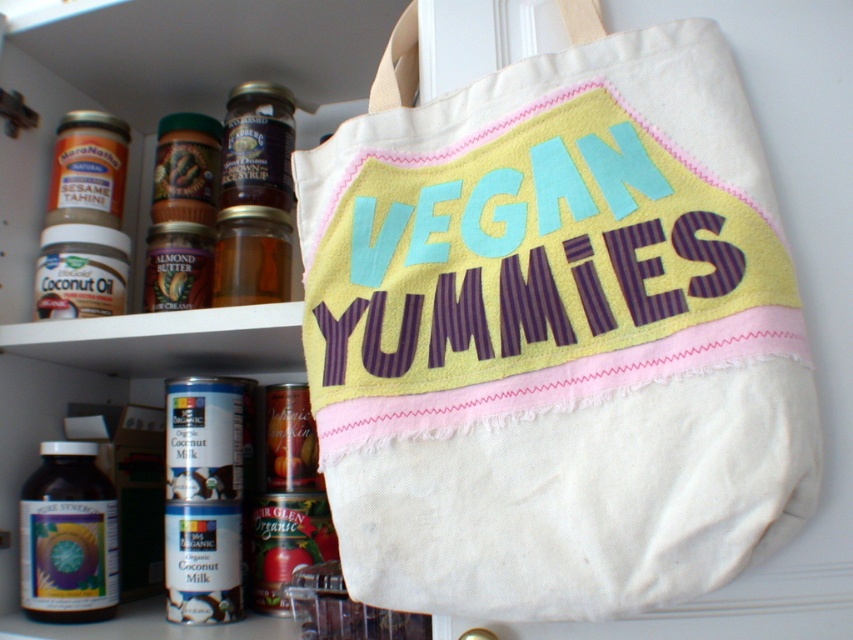
You are organizing a picnic and have both the white canvas tote at center and the translucent glass bottle at lower left. Which item can hold more items due to its size?

The white canvas tote at center is larger in size than the translucent glass bottle at lower left, so it can hold more items.

You are standing in front of the shelf with the VEGAN YUMMIES tote bag. You see two points marked on the shelf. The first point is at coordinate (415, 38) and the second is at (76, 444). Which point is closer to you?

Point (415, 38) is closer to you because it is in front of point (76, 444).

You are organizing a picnic basket and need to access the translucent glass bottle at lower left. However, the white canvas tote at center is blocking your path. Can you easily reach the bottle without moving the tote?

The white canvas tote at center is in front of the translucent glass bottle at lower left, so you cannot easily reach the bottle without moving the tote.